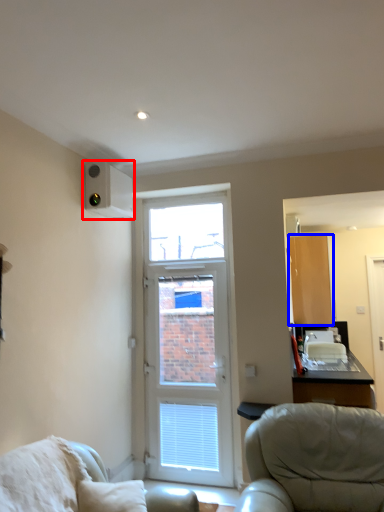
Question: Which point is further to the camera, air conditioning (highlighted by a red box) or cabinetry (highlighted by a blue box)?

Choices:
 (A) air conditioning
 (B) cabinetry

Answer: (B)